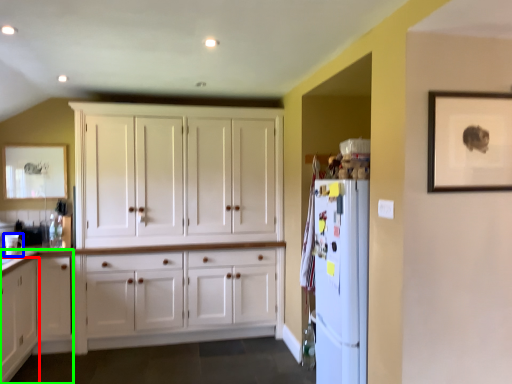
Question: Based on their relative distances, which object is nearer to cabinetry (highlighted by a red box)? Choose from appliance (highlighted by a blue box) and dresser (highlighted by a green box).

Choices:
 (A) appliance
 (B) dresser

Answer: (B)